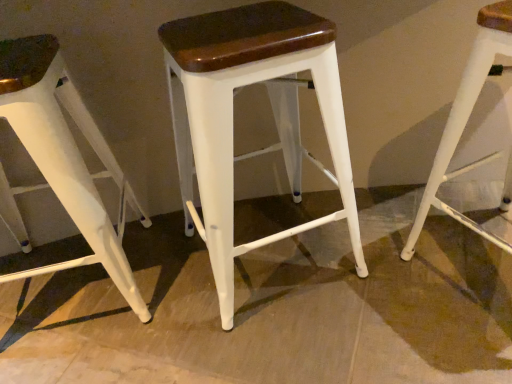
You are a GUI agent. You are given a task and a screenshot of the screen. Output one action in this format:
    pyautogui.click(x=<x>, y=<y>)
    Task: Click on the white matte stool at center, the 2th stool from the left
    
    Given the screenshot: What is the action you would take?
    pyautogui.click(x=232, y=117)

Identify the location of white matte stool at center, which is the 3th stool in left-to-right order. pyautogui.click(x=466, y=120).

The image size is (512, 384). Find the location of `white matte stool at center, the 2th stool from the left`. white matte stool at center, the 2th stool from the left is located at coordinates (232, 117).

From a real-world perspective, which is physically above, white matte stool at center, which is the 1th stool from right to left, or white matte stool at center, placed as the 2th stool when sorted from right to left?

In real-world perspective, white matte stool at center, which is the 1th stool from right to left, is above.

Is white matte stool at center, which is the 1th stool from right to left, far from white matte stool at center, the 2th stool from the left?

That's not correct — white matte stool at center, which is the 1th stool from right to left, is a little close to white matte stool at center, the 2th stool from the left.

Can you confirm if white matte stool at center, which is the 3th stool in left-to-right order, is taller than white matte stool at center, the 2th stool from the left?

Indeed, white matte stool at center, which is the 3th stool in left-to-right order, has a greater height compared to white matte stool at center, the 2th stool from the left.

Considering the positions of points (469, 224) and (102, 263), is point (469, 224) farther from camera compared to point (102, 263)?

No, it is not.

From a real-world perspective, is white matte stool at center, which is the 3th stool in left-to-right order, above or below white matte stool at left, the 1th stool viewed from the left?

white matte stool at center, which is the 3th stool in left-to-right order, is above white matte stool at left, the 1th stool viewed from the left.

From the image's perspective, which one is positioned higher, white matte stool at center, which is the 3th stool in left-to-right order, or white matte stool at left, the 1th stool viewed from the left?

From the image's view, white matte stool at center, which is the 3th stool in left-to-right order, is above.

Is white matte stool at center, which is the 1th stool from right to left, positioned far away from white matte stool at left, the 1th stool viewed from the left?

They are positioned close to each other.

Can you confirm if white matte stool at left, placed as the 3th stool when sorted from right to left, is shorter than white matte stool at center, the 2th stool from the left?

Incorrect, the height of white matte stool at left, placed as the 3th stool when sorted from right to left, does not fall short of that of white matte stool at center, the 2th stool from the left.

In the scene shown: Can you confirm if white matte stool at left, placed as the 3th stool when sorted from right to left, is smaller than white matte stool at center, placed as the 2th stool when sorted from right to left?

Yes.

Are white matte stool at left, the 1th stool viewed from the left, and white matte stool at center, placed as the 2th stool when sorted from right to left, making contact?

They are not placed beside each other.

How much distance is there between white matte stool at center, the 2th stool from the left, and white matte stool at center, which is the 1th stool from right to left?

16.43 inches.

Could you tell me if white matte stool at center, placed as the 2th stool when sorted from right to left, is turned towards white matte stool at center, which is the 3th stool in left-to-right order?

No, white matte stool at center, placed as the 2th stool when sorted from right to left, does not turn towards white matte stool at center, which is the 3th stool in left-to-right order.

How many degrees apart are the facing directions of white matte stool at center, placed as the 2th stool when sorted from right to left, and white matte stool at center, which is the 1th stool from right to left?

6.12 degrees.

Is white matte stool at center, the 2th stool from the left, wider than white matte stool at center, which is the 3th stool in left-to-right order?

Indeed, white matte stool at center, the 2th stool from the left, has a greater width compared to white matte stool at center, which is the 3th stool in left-to-right order.

Considering the relative sizes of white matte stool at center, the 2th stool from the left, and white matte stool at left, the 1th stool viewed from the left, in the image provided, is white matte stool at center, the 2th stool from the left, thinner than white matte stool at left, the 1th stool viewed from the left,?

Result: No.

From the image's perspective, is white matte stool at center, placed as the 2th stool when sorted from right to left, located above or below white matte stool at left, placed as the 3th stool when sorted from right to left?

Clearly, from the image's perspective, white matte stool at center, placed as the 2th stool when sorted from right to left, is above white matte stool at left, placed as the 3th stool when sorted from right to left.

Considering the relative positions of white matte stool at center, placed as the 2th stool when sorted from right to left, and white matte stool at left, the 1th stool viewed from the left, in the image provided, is white matte stool at center, placed as the 2th stool when sorted from right to left, to the left or to the right of white matte stool at left, the 1th stool viewed from the left,?

From the image, it's evident that white matte stool at center, placed as the 2th stool when sorted from right to left, is to the right of white matte stool at left, the 1th stool viewed from the left.

Which object is closer to the camera, white matte stool at center, the 2th stool from the left, or white matte stool at left, the 1th stool viewed from the left?

white matte stool at center, the 2th stool from the left, is closer to the camera.

Between white matte stool at left, the 1th stool viewed from the left, and white matte stool at center, which is the 1th stool from right to left, which one appears on the left side from the viewer's perspective?

white matte stool at left, the 1th stool viewed from the left, is more to the left.

Which is closer to the camera, (70, 171) or (499, 51)?

Positioned in front is point (499, 51).

From the picture: Considering the sizes of white matte stool at left, the 1th stool viewed from the left, and white matte stool at center, which is the 1th stool from right to left, in the image, is white matte stool at left, the 1th stool viewed from the left, bigger or smaller than white matte stool at center, which is the 1th stool from right to left,?

Clearly, white matte stool at left, the 1th stool viewed from the left, is larger in size than white matte stool at center, which is the 1th stool from right to left.

Considering the sizes of white matte stool at left, placed as the 3th stool when sorted from right to left, and white matte stool at center, which is the 3th stool in left-to-right order, in the image, is white matte stool at left, placed as the 3th stool when sorted from right to left, taller or shorter than white matte stool at center, which is the 3th stool in left-to-right order,?

Considering their sizes, white matte stool at left, placed as the 3th stool when sorted from right to left, has more height than white matte stool at center, which is the 3th stool in left-to-right order.

There is a white matte stool at center, placed as the 2th stool when sorted from right to left. Where is `the 1st stool below it (from the image's perspective)`? This screenshot has width=512, height=384. the 1st stool below it (from the image's perspective) is located at coordinates (466, 120).

Which stool is the 2nd one when counting from the front of the white matte stool at left, the 1th stool viewed from the left? Please provide its 2D coordinates.

[(466, 120)]

Based on their spatial positions, is white matte stool at left, the 1th stool viewed from the left, or white matte stool at center, placed as the 2th stool when sorted from right to left, closer to white matte stool at center, which is the 3th stool in left-to-right order?

white matte stool at center, placed as the 2th stool when sorted from right to left, lies closer to white matte stool at center, which is the 3th stool in left-to-right order, than the other object.

From the image, which object appears to be farther from white matte stool at center, the 2th stool from the left, white matte stool at center, which is the 3th stool in left-to-right order, or white matte stool at left, the 1th stool viewed from the left?

Among the two, white matte stool at center, which is the 3th stool in left-to-right order, is located further to white matte stool at center, the 2th stool from the left.

Looking at the image, which one is located further to white matte stool at left, placed as the 3th stool when sorted from right to left, white matte stool at center, which is the 1th stool from right to left, or white matte stool at center, the 2th stool from the left?

white matte stool at center, which is the 1th stool from right to left, lies further to white matte stool at left, placed as the 3th stool when sorted from right to left, than the other object.

When comparing their distances from white matte stool at center, which is the 3th stool in left-to-right order, does white matte stool at center, placed as the 2th stool when sorted from right to left, or white matte stool at left, placed as the 3th stool when sorted from right to left, seem closer?

white matte stool at center, placed as the 2th stool when sorted from right to left.

Looking at the image, which one is located further to white matte stool at center, the 2th stool from the left, white matte stool at left, placed as the 3th stool when sorted from right to left, or white matte stool at center, which is the 3th stool in left-to-right order?

white matte stool at center, which is the 3th stool in left-to-right order, is further to white matte stool at center, the 2th stool from the left.

Looking at the image, which one is located further to white matte stool at left, placed as the 3th stool when sorted from right to left, white matte stool at center, the 2th stool from the left, or white matte stool at center, which is the 1th stool from right to left?

white matte stool at center, which is the 1th stool from right to left, lies further to white matte stool at left, placed as the 3th stool when sorted from right to left, than the other object.

Where is `stool between white matte stool at left, placed as the 3th stool when sorted from right to left, and white matte stool at center, which is the 1th stool from right to left, in the horizontal direction`? The width and height of the screenshot is (512, 384). stool between white matte stool at left, placed as the 3th stool when sorted from right to left, and white matte stool at center, which is the 1th stool from right to left, in the horizontal direction is located at coordinates (232, 117).